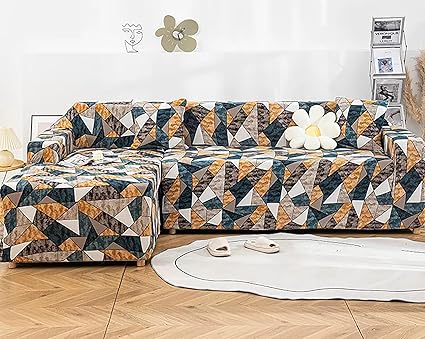
Where is `parquet flooring`? This screenshot has height=339, width=425. parquet flooring is located at coordinates (141, 317).